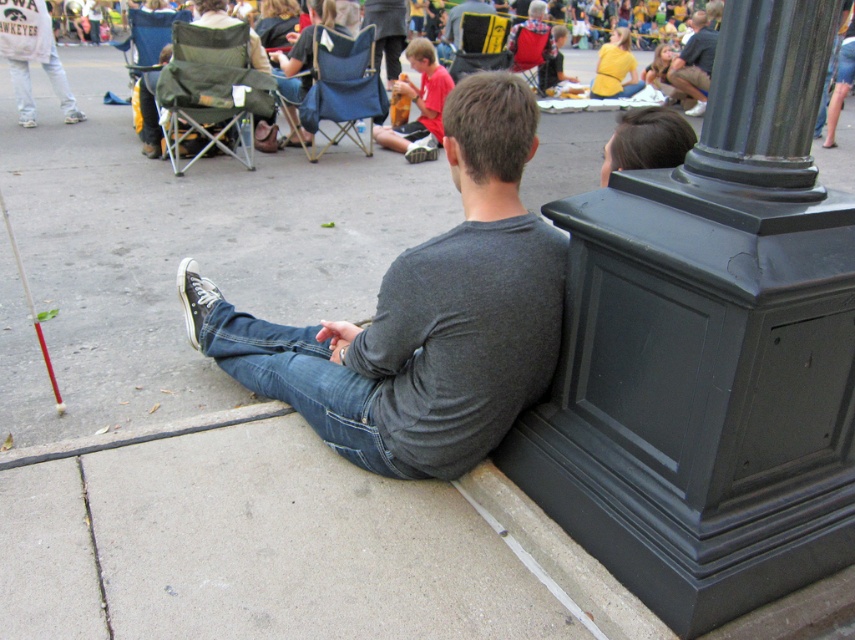
You are a photographer trying to capture a photo of the dark gray shirt at center without including the yellow fabric chair at center in the frame. Based on their positions, is this possible?

The yellow fabric chair at center is positioned on the left side of dark gray shirt at center. Therefore, to avoid including the yellow fabric chair at center in the photo, the photographer should aim to frame the dark gray shirt at center from the right side, ensuring the yellow fabric chair at center is out of the shot.